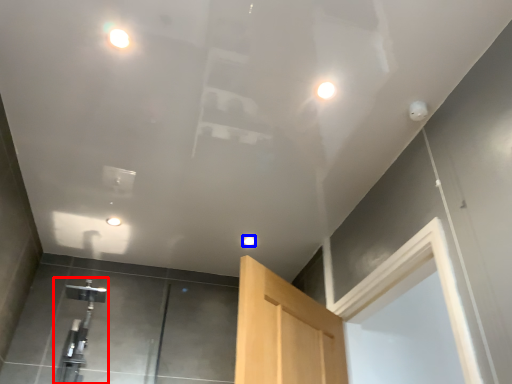
Question: Which point is closer to the camera, faucet (highlighted by a red box) or droplight (highlighted by a blue box)?

Choices:
 (A) faucet
 (B) droplight

Answer: (A)